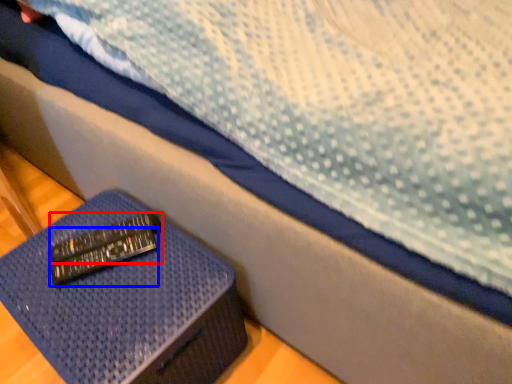
Question: Which point is closer to the camera, remote (highlighted by a red box) or remote (highlighted by a blue box)?

Choices:
 (A) remote
 (B) remote

Answer: (B)